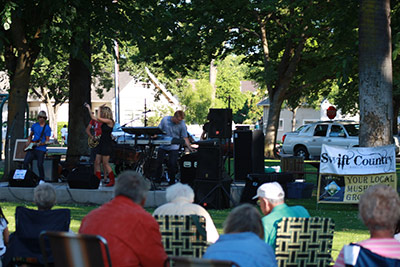
This screenshot has height=267, width=400. I want to click on chair, so [x=190, y=231], [x=314, y=236], [x=368, y=257], [x=65, y=261], [x=33, y=222], [x=25, y=255].